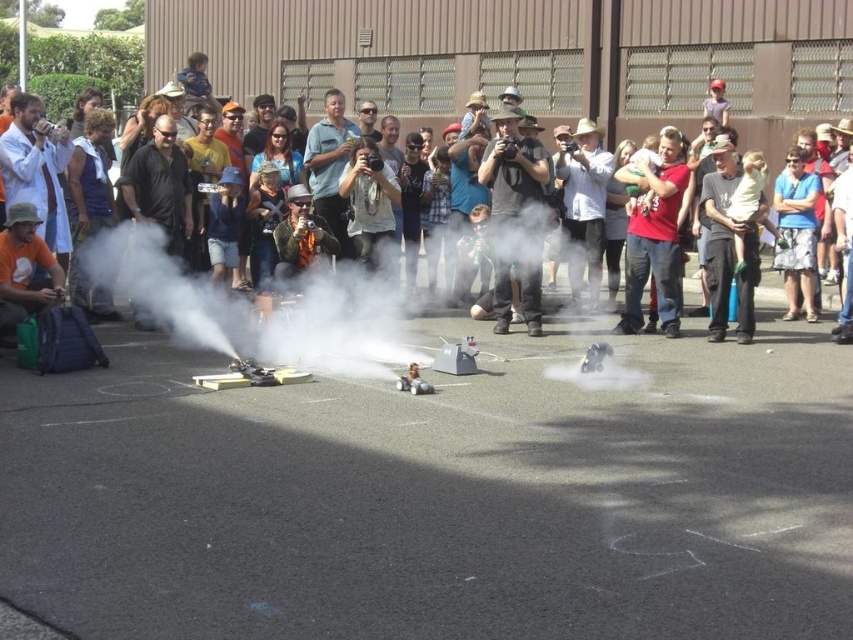
Who is more distant from viewer, (x=506, y=307) or (x=766, y=204)?

Positioned behind is point (x=506, y=307).

Does matte black camera at center appear on the left side of matte gray shirt at center?

Yes, matte black camera at center is to the left of matte gray shirt at center.

Locate an element on the screen. matte black camera at center is located at coordinates (515, 218).

Does red cotton shirt at center have a lesser width compared to blue floral shorts at center?

In fact, red cotton shirt at center might be wider than blue floral shorts at center.

Which is below, red cotton shirt at center or blue floral shorts at center?

Positioned lower is red cotton shirt at center.

Where is `red cotton shirt at center`? Image resolution: width=853 pixels, height=640 pixels. red cotton shirt at center is located at coordinates (654, 234).

Is the position of matte black laptop at center less distant than that of blue floral shorts at center?

Yes.

Can you confirm if matte black laptop at center is bigger than blue floral shorts at center?

Yes.

Between point (590, 173) and point (804, 269), which one is positioned behind?

Point (590, 173)

At what (x,y) coordinates should I click in order to perform the action: click on matte black laptop at center. Please return your answer as a coordinate pair (x, y). The image size is (853, 640). Looking at the image, I should click on (30, 173).